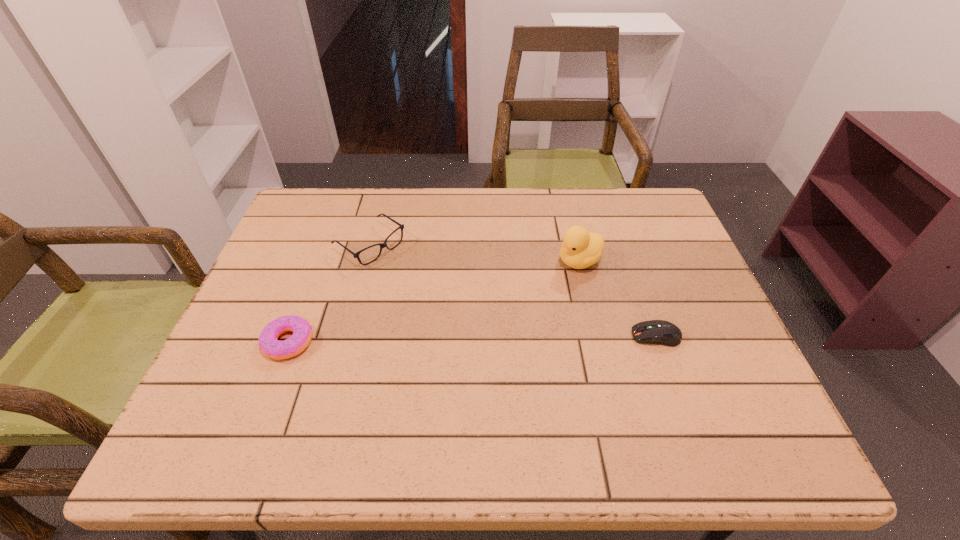
This screenshot has height=540, width=960. I want to click on doughnut, so click(x=302, y=331).

At what (x,y) coordinates should I click in order to perform the action: click on the rightmost object. Please return your answer as a coordinate pair (x, y). The image size is (960, 540). Looking at the image, I should click on (661, 332).

The width and height of the screenshot is (960, 540). I want to click on the third shortest object, so pyautogui.click(x=382, y=245).

Where is `duck`? Image resolution: width=960 pixels, height=540 pixels. duck is located at coordinates (580, 249).

I want to click on the tallest object, so click(x=580, y=249).

Find the location of a particular element. The height and width of the screenshot is (540, 960). blank space located 0.330m on the right of the doughnut is located at coordinates (459, 342).

The image size is (960, 540). Identify the location of vacant space located on the button of the rightmost object. (488, 336).

I want to click on free spot located on the button of the rightmost object, so (579, 336).

This screenshot has width=960, height=540. Identify the location of free space located on the button of the rightmost object. (597, 336).

You are a GUI agent. You are given a task and a screenshot of the screen. Output one action in this format:
    pyautogui.click(x=<x>, y=<y>)
    Task: Click on the vacant region located 0.260m on the front-facing side of the second tallest object
    The height and width of the screenshot is (540, 960).
    Given the screenshot: What is the action you would take?
    pyautogui.click(x=463, y=310)